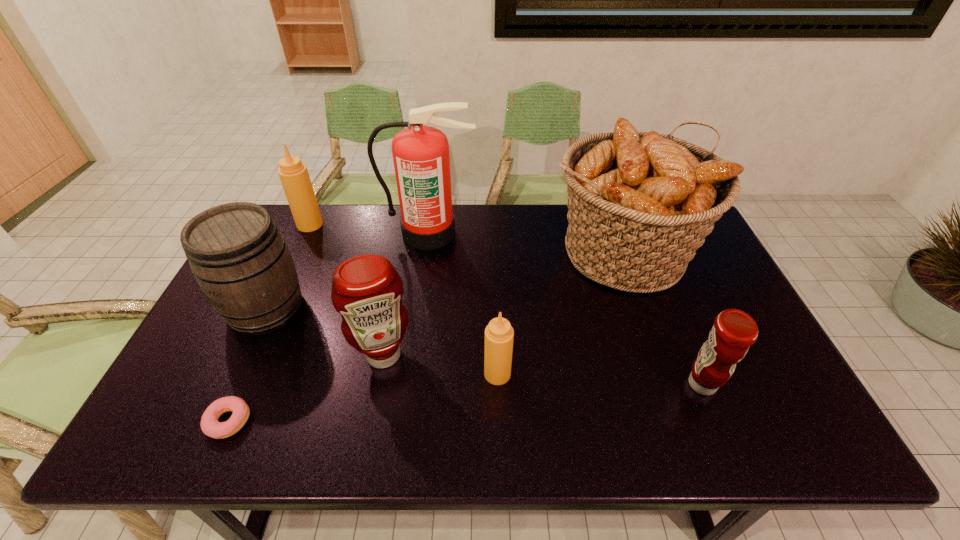
Image resolution: width=960 pixels, height=540 pixels. Identify the location of the smaller tan condiment. (499, 334).

Identify the location of the right tan condiment. The width and height of the screenshot is (960, 540). (499, 334).

Where is `the shortest object`? This screenshot has width=960, height=540. the shortest object is located at coordinates (210, 425).

Locate an element on the screen. The width and height of the screenshot is (960, 540). doughnut is located at coordinates (210, 425).

Find the location of a particular element. free location located at the nozzle of the red fire extinguisher is located at coordinates (421, 294).

Where is `free spot located on the left of the seventh shortest object`? This screenshot has width=960, height=540. free spot located on the left of the seventh shortest object is located at coordinates (425, 251).

Find the location of a particular element. free region located on the right of the farther tan condiment is located at coordinates (401, 225).

This screenshot has height=540, width=960. What are the coordinates of `vacant space situated 0.160m on the left of the bigger red condiment` in the screenshot? It's located at (291, 355).

Where is `vacant space located on the right of the wine bucket`? This screenshot has width=960, height=540. vacant space located on the right of the wine bucket is located at coordinates (431, 308).

At what (x,y) coordinates should I click in order to perform the action: click on vacant space located 0.130m on the back of the smaller red condiment. Please return your answer as a coordinate pair (x, y). Looking at the image, I should click on (678, 325).